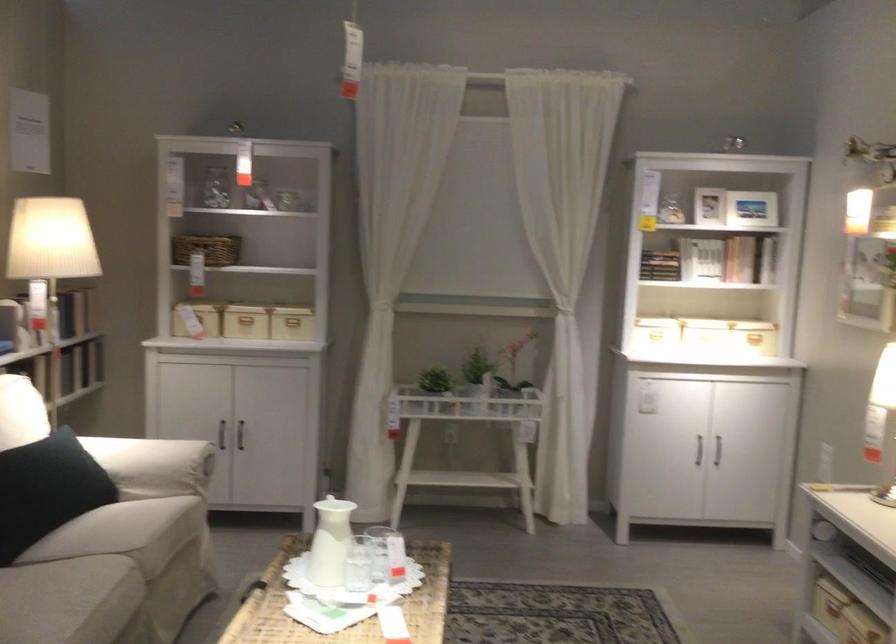
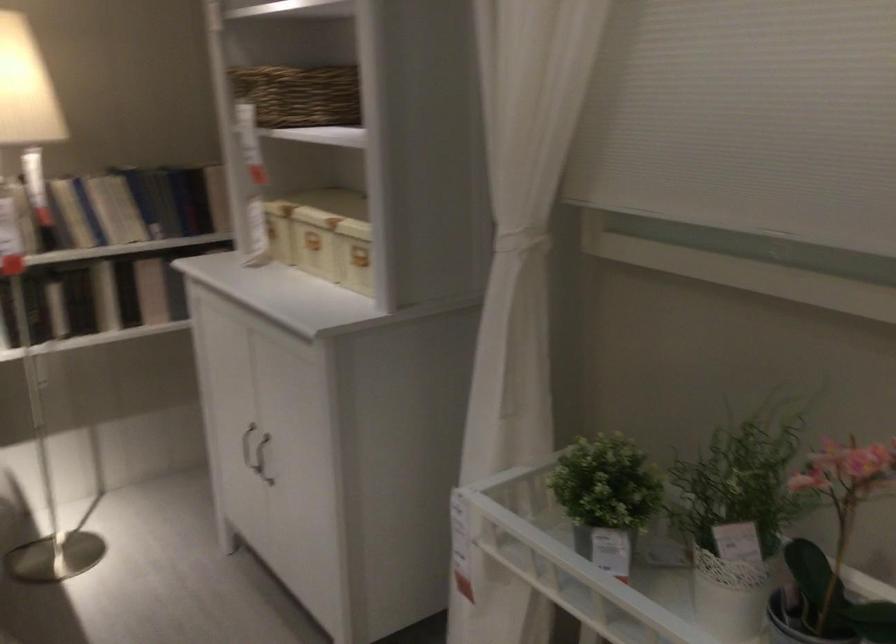
The point at [504,375] is marked in the first image. Where is the corresponding point in the second image?

(735, 518)